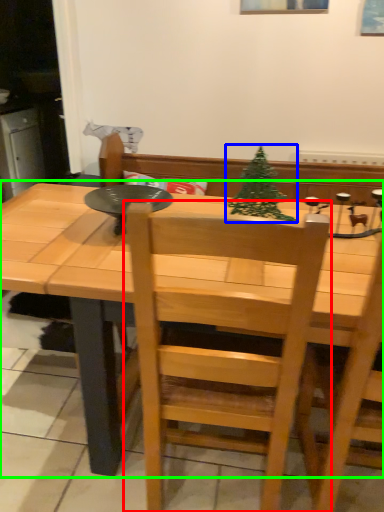
Question: Considering the real-world distances, which object is closest to chair (highlighted by a red box)? christmas tree (highlighted by a blue box) or table (highlighted by a green box).

Choices:
 (A) christmas tree
 (B) table

Answer: (B)